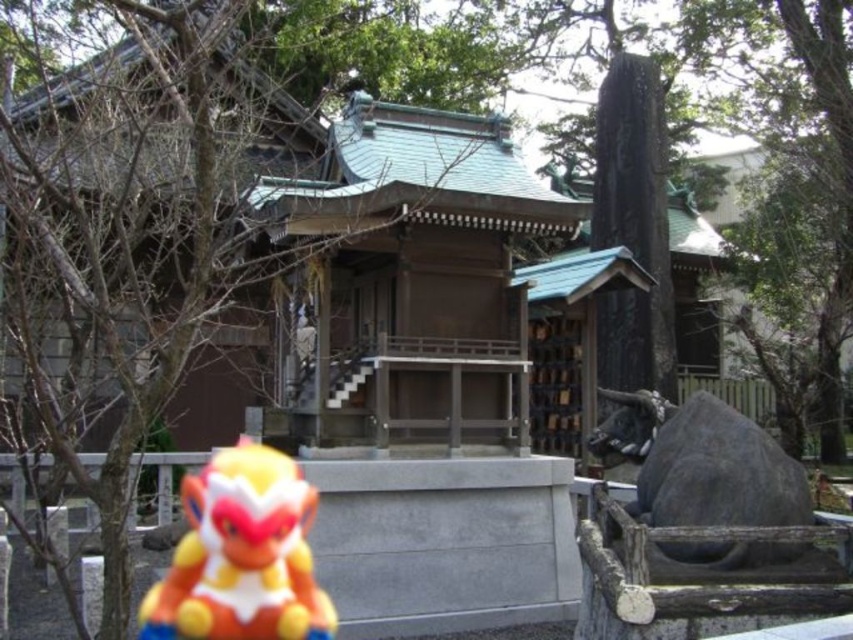
Is matte plastic monkey at lower left bigger than gray stone bull at right?

Yes, matte plastic monkey at lower left is bigger than gray stone bull at right.

Does matte plastic monkey at lower left have a smaller size compared to gray stone bull at right?

Incorrect, matte plastic monkey at lower left is not smaller in size than gray stone bull at right.

The width and height of the screenshot is (853, 640). Find the location of `matte plastic monkey at lower left`. matte plastic monkey at lower left is located at coordinates [x=241, y=556].